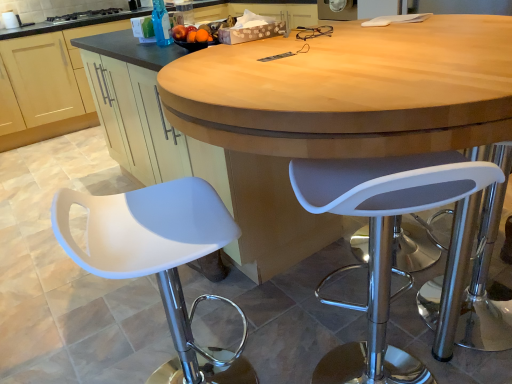
Question: Based on their positions, is white plastic stool at right, which is counted as the 1th chair, starting from the right, located to the left or right of black glass stove at upper left?

Choices:
 (A) right
 (B) left

Answer: (A)

Question: From a real-world perspective, relative to black glass stove at upper left, is white plastic stool at right, marked as the 2th chair in a left-to-right arrangement, vertically above or below?

Choices:
 (A) below
 (B) above

Answer: (A)

Question: Which object is the closest to the matte wood table at center?

Choices:
 (A) white matte stool at left, positioned as the first chair in left-to-right order
 (B) transparent plastic bottle at upper center
 (C) matte wood cabinet at lower left
 (D) black glass stove at upper left
 (E) white plastic stool at right, marked as the 2th chair in a left-to-right arrangement

Answer: (E)

Question: Which of these objects is positioned closest to the white plastic stool at right, which is counted as the 1th chair, starting from the right?

Choices:
 (A) black glass stove at upper left
 (B) matte wood table at center
 (C) white matte stool at left, positioned as the first chair in left-to-right order
 (D) transparent plastic bottle at upper center
 (E) matte wood cabinet at lower left

Answer: (B)